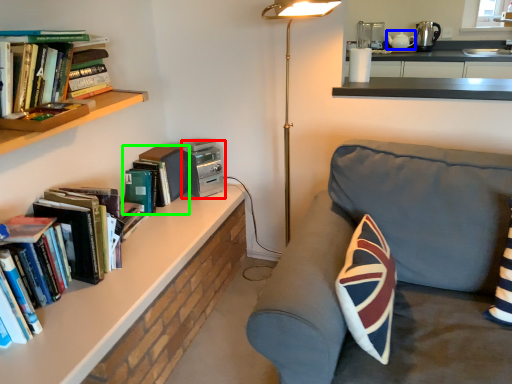
Question: Considering the real-world distances, which object is farthest from appliance (highlighted by a red box)? appliance (highlighted by a blue box) or book (highlighted by a green box)?

Choices:
 (A) appliance
 (B) book

Answer: (A)